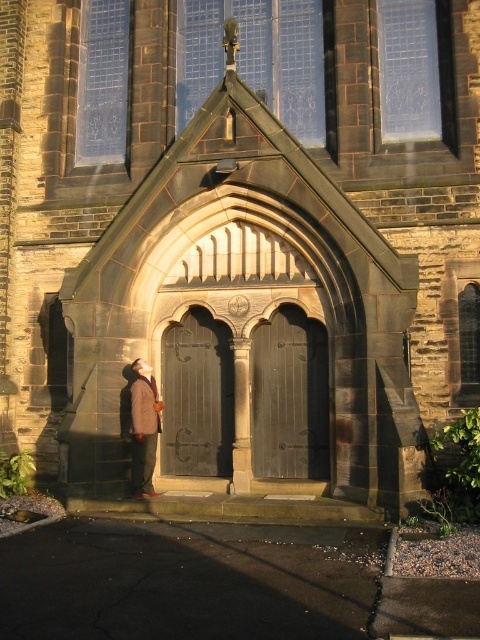
Which of these two, dark brown wooden door at center or brown wool coat at lower left, stands taller?

With more height is dark brown wooden door at center.

Does dark brown wooden door at center have a lesser height compared to brown wool coat at lower left?

In fact, dark brown wooden door at center may be taller than brown wool coat at lower left.

Is point (288, 314) farther from viewer compared to point (132, 419)?

Yes, it is.

I want to click on dark brown wooden door at center, so [288, 396].

Does dark gray stone door at center have a larger size compared to brown wool coat at lower left?

Yes.

Does point (204, 385) lie in front of point (132, 420)?

That is False.

Locate an element on the screen. dark gray stone door at center is located at coordinates click(196, 396).

Is point (301, 458) farther from camera compared to point (162, 360)?

No, it is not.

Between point (286, 369) and point (163, 342), which one is positioned in front?

Point (286, 369) is more forward.

Locate an element on the screen. Image resolution: width=480 pixels, height=640 pixels. dark brown wooden door at center is located at coordinates (288, 396).